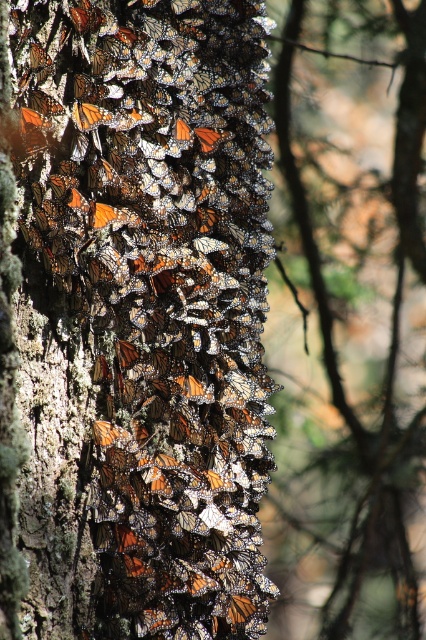
Question: Does orange and black wings at center have a greater width compared to orange-brown bark tree trunk at left?

Choices:
 (A) no
 (B) yes

Answer: (A)

Question: Can you confirm if orange and black wings at center is thinner than orange-brown bark tree trunk at left?

Choices:
 (A) yes
 (B) no

Answer: (A)

Question: Which of the following is the closest to the observer?

Choices:
 (A) (255, 196)
 (B) (397, 493)

Answer: (A)

Question: Among these points, which one is nearest to the camera?

Choices:
 (A) (275, 554)
 (B) (239, 52)

Answer: (B)

Question: Does orange and black wings at center appear on the left side of orange-brown bark tree trunk at left?

Choices:
 (A) no
 (B) yes

Answer: (B)